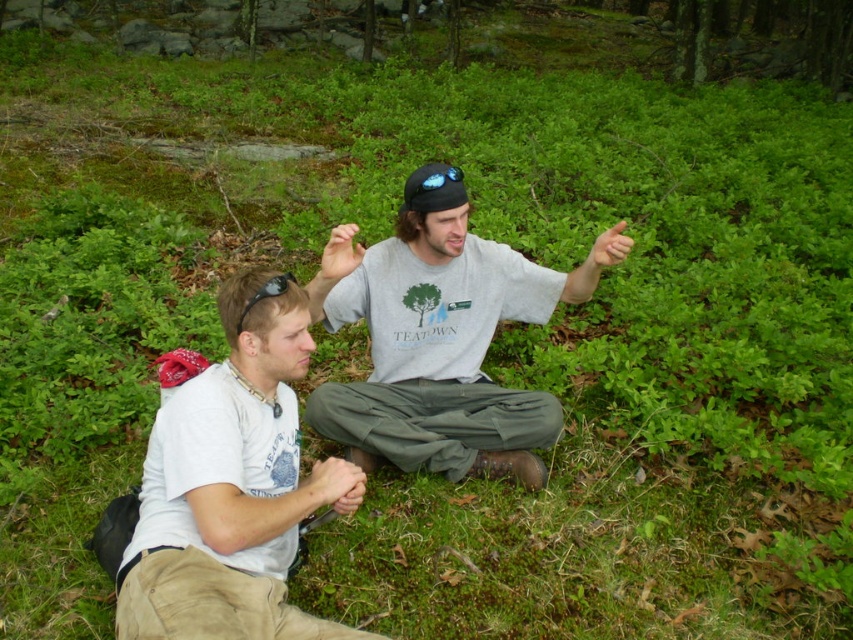
Does white cotton shirt at lower left appear under smooth skin hand at center?

No, white cotton shirt at lower left is not below smooth skin hand at center.

Does white cotton shirt at lower left have a greater height compared to smooth skin hand at center?

Indeed, white cotton shirt at lower left has a greater height compared to smooth skin hand at center.

Which is in front, point (198, 458) or point (352, 490)?

Point (198, 458)

Locate an element on the screen. white cotton shirt at lower left is located at coordinates (227, 484).

Does smooth skin hand at center appear over matte gray hand at center?

No, smooth skin hand at center is not above matte gray hand at center.

Can you confirm if smooth skin hand at center is shorter than matte gray hand at center?

Yes, smooth skin hand at center is shorter than matte gray hand at center.

Who is more distant from viewer, (349, 481) or (357, 259)?

The point (357, 259) is more distant.

I want to click on smooth skin hand at center, so click(x=335, y=484).

Is the position of smooth skin hand at center less distant than that of matte black thumb at upper right?

Yes.

Between point (347, 506) and point (619, 257), which one is positioned behind?

The point (619, 257) is more distant.

Is point (318, 472) positioned in front of point (616, 230)?

That is True.

Identify the location of smooth skin hand at center. (335, 484).